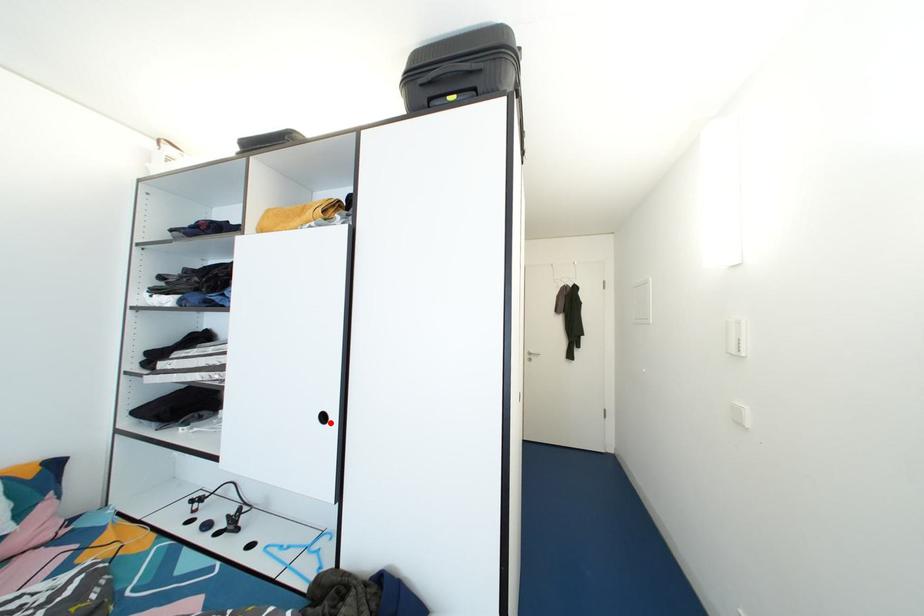
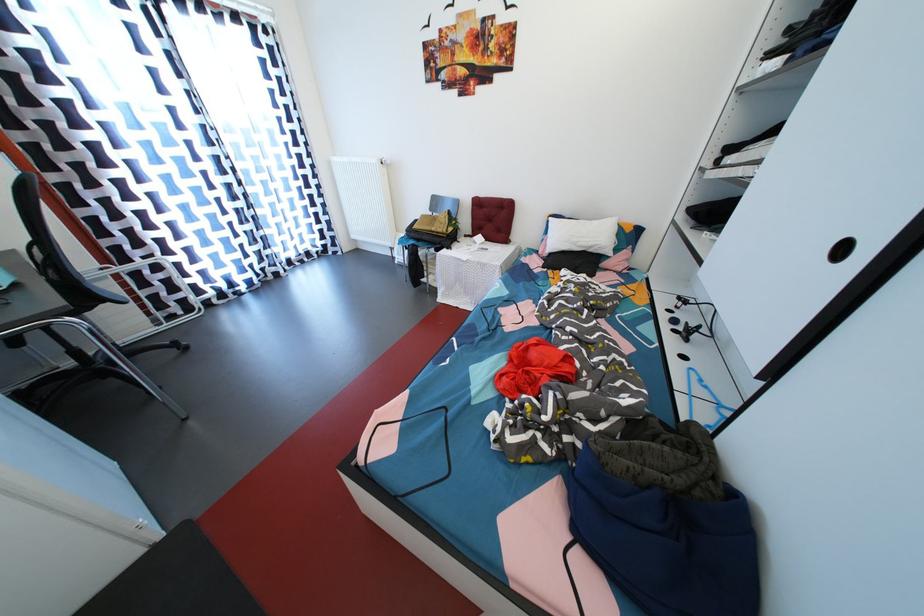
Locate, in the second image, the point that corresponds to the highlighted location in the first image.

(848, 254)